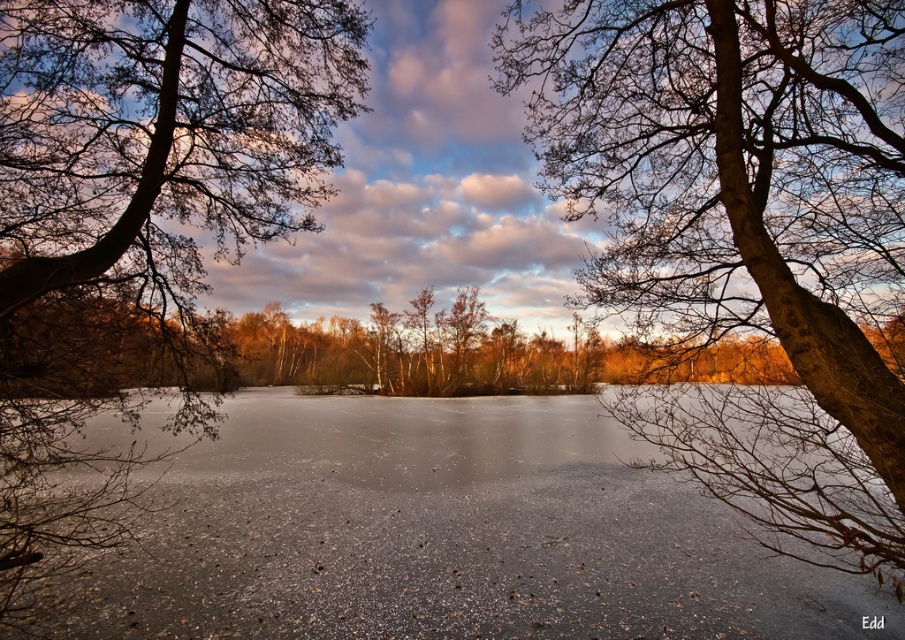
You are standing on the frozen lake and want to walk towards the brown rough bark tree at upper right and the brown rough bark tree at left. Which tree will you see first as you approach the trees?

The brown rough bark tree at upper right will be seen first because it is positioned below the brown rough bark tree at left, meaning it is closer to the observer.